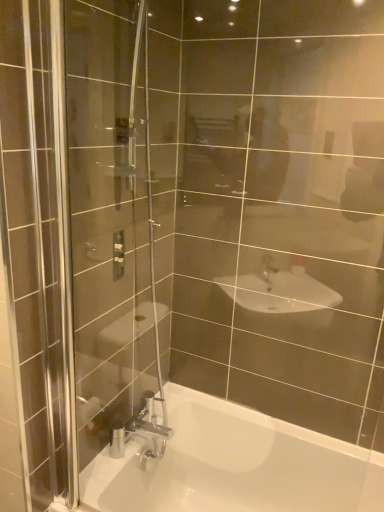
Question: Considering the relative positions of matte silver shower controls at upper left and white glossy bathtub at lower center in the image provided, is matte silver shower controls at upper left to the left of white glossy bathtub at lower center from the viewer's perspective?

Choices:
 (A) no
 (B) yes

Answer: (B)

Question: Is there a large distance between matte silver shower controls at upper left and white glossy bathtub at lower center?

Choices:
 (A) no
 (B) yes

Answer: (A)

Question: Can we say matte silver shower controls at upper left lies outside white glossy bathtub at lower center?

Choices:
 (A) no
 (B) yes

Answer: (B)

Question: Is the depth of matte silver shower controls at upper left less than that of white glossy bathtub at lower center?

Choices:
 (A) no
 (B) yes

Answer: (A)

Question: Is matte silver shower controls at upper left oriented towards white glossy bathtub at lower center?

Choices:
 (A) yes
 (B) no

Answer: (B)

Question: Is matte silver shower controls at upper left directly adjacent to white glossy bathtub at lower center?

Choices:
 (A) yes
 (B) no

Answer: (B)

Question: From a real-world perspective, does white glossy bathtub at lower center sit lower than matte silver shower controls at upper left?

Choices:
 (A) no
 (B) yes

Answer: (B)

Question: Is white glossy bathtub at lower center aimed at matte silver shower controls at upper left?

Choices:
 (A) no
 (B) yes

Answer: (A)

Question: Can matte silver shower controls at upper left be found inside white glossy bathtub at lower center?

Choices:
 (A) no
 (B) yes

Answer: (A)

Question: Is white glossy bathtub at lower center not close to matte silver shower controls at upper left?

Choices:
 (A) no
 (B) yes

Answer: (A)

Question: Can you confirm if white glossy bathtub at lower center is shorter than matte silver shower controls at upper left?

Choices:
 (A) yes
 (B) no

Answer: (B)

Question: Is the position of white glossy bathtub at lower center more distant than that of matte silver shower controls at upper left?

Choices:
 (A) no
 (B) yes

Answer: (A)

Question: Is matte silver shower controls at upper left bigger or smaller than white glossy bathtub at lower center?

Choices:
 (A) big
 (B) small

Answer: (B)